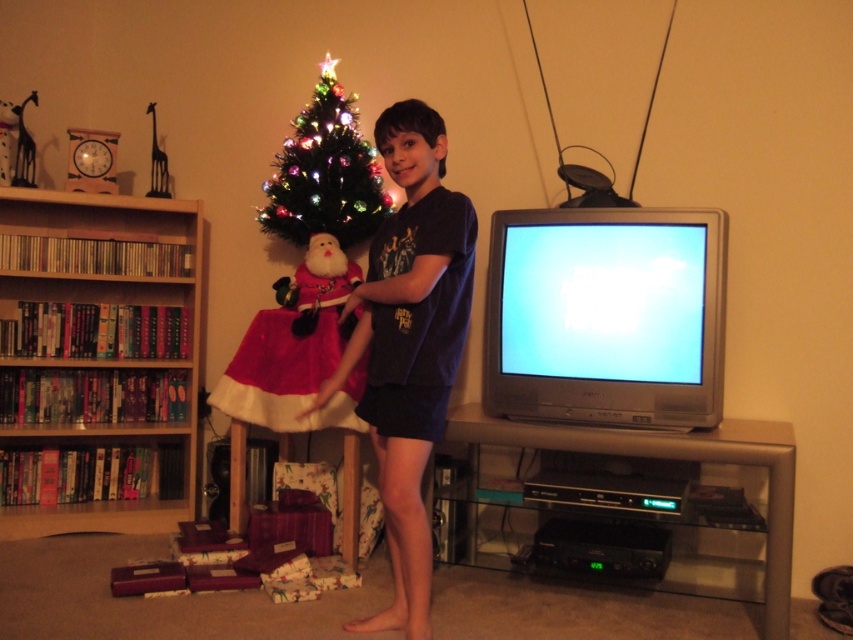
Question: Based on their relative distances, which object is nearer to the multicolored lights christmas tree at center?

Choices:
 (A) dark blue t-shirt at center
 (B) wooden bookshelf at left
 (C) velvet santa at center

Answer: (C)

Question: Which of the following is the farthest from the observer?

Choices:
 (A) multicolored lights christmas tree at center
 (B) velvet santa at center

Answer: (A)

Question: Which point is closer to the camera?

Choices:
 (A) (42, 442)
 (B) (271, 420)

Answer: (B)

Question: Can you confirm if velvet santa at center is positioned to the left of multicolored lights christmas tree at center?

Choices:
 (A) no
 (B) yes

Answer: (B)

Question: In this image, where is velvet santa at center located relative to multicolored lights christmas tree at center?

Choices:
 (A) left
 (B) right

Answer: (A)

Question: Is velvet santa at center positioned in front of multicolored lights christmas tree at center?

Choices:
 (A) no
 (B) yes

Answer: (B)